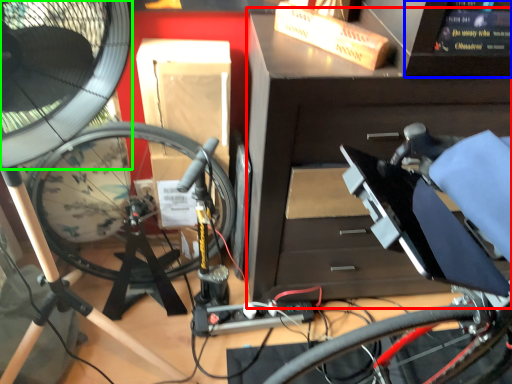
Question: Estimate the real-world distances between objects in this image. Which object is farther from workbench (highlighted by a red box), computer screen (highlighted by a blue box) or mechanical fan (highlighted by a green box)?

Choices:
 (A) computer screen
 (B) mechanical fan

Answer: (B)